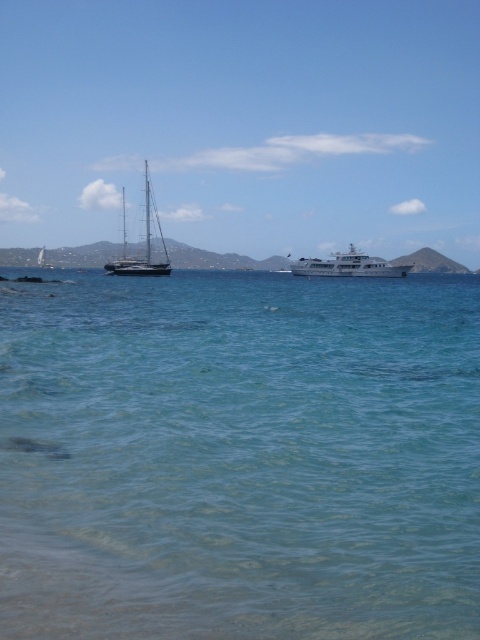
Is white glossy yacht at center positioned before shiny silver sailboat at left?

No.

Between white glossy yacht at center and shiny silver sailboat at left, which one appears on the right side from the viewer's perspective?

white glossy yacht at center is more to the right.

Is point (351, 269) positioned after point (167, 260)?

Yes, it is behind point (167, 260).

The image size is (480, 640). I want to click on white glossy yacht at center, so click(x=348, y=266).

Can you confirm if clear water at lower center is bigger than shiny silver sailboat at left?

No.

Find the location of `clear water at lower center`. clear water at lower center is located at coordinates (240, 458).

Find the location of a particular element. The image size is (480, 640). clear water at lower center is located at coordinates click(240, 458).

Can you confirm if clear water at lower center is shorter than white glossy yacht at center?

No.

Is point (141, 541) farther from viewer compared to point (336, 272)?

No, it is not.

This screenshot has width=480, height=640. What do you see at coordinates (240, 458) in the screenshot?
I see `clear water at lower center` at bounding box center [240, 458].

Locate an element on the screen. This screenshot has width=480, height=640. clear water at lower center is located at coordinates (240, 458).